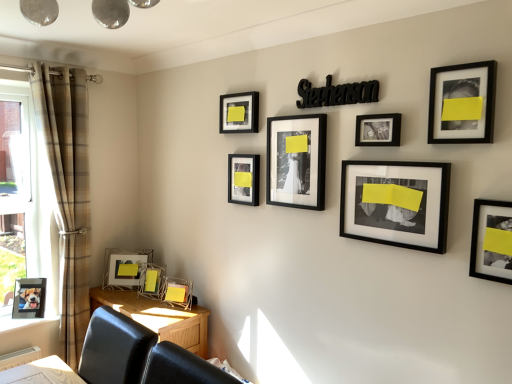
Question: Is black matte photo frame at center right, arranged as the eighth picture frame when viewed from the left, to the left or to the right of matte black photo frame at center, arranged as the fifth picture frame when viewed from the left, in the image?

Choices:
 (A) right
 (B) left

Answer: (A)

Question: In terms of height, does black matte photo frame at center right, arranged as the eighth picture frame when viewed from the left, look taller or shorter compared to matte black photo frame at center, the 6th picture frame from the right?

Choices:
 (A) short
 (B) tall

Answer: (B)

Question: Considering the real-world distances, which object is farthest from the wooden table at lower left?

Choices:
 (A) matte black photo frame at center, the 6th picture frame from the right
 (B) matte black picture frame at upper center, which is the 4th picture frame from left to right
 (C) black matte photo frame at center right, arranged as the eighth picture frame when viewed from the left
 (D) metallic silver picture frame at lower left, which ranks as the tenth picture frame in right-to-left order
 (E) metallic silver picture frame at lower left, the 2th picture frame in the left-to-right sequence

Answer: (C)

Question: Which object is positioned farthest from the black matte photo frame at center right, which is the 3th picture frame in right-to-left order?

Choices:
 (A) clear glass window at left
 (B) metallic silver picture frame at lower left, which ranks as the tenth picture frame in right-to-left order
 (C) black matte picture frame at upper right, arranged as the ninth picture frame when viewed from the left
 (D) matte black photo frame at center, arranged as the fifth picture frame when viewed from the left
 (E) brown plaid curtain at left

Answer: (B)